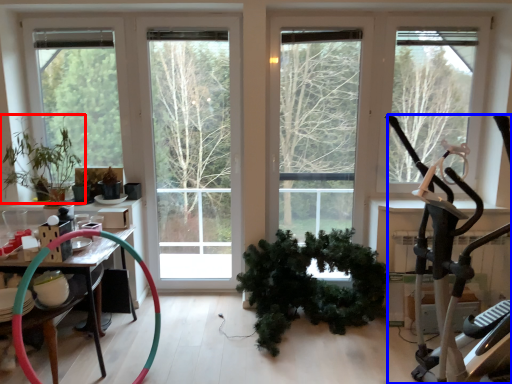
Question: Which object is closer to the camera taking this photo, houseplant (highlighted by a red box) or stationary bicycle (highlighted by a blue box)?

Choices:
 (A) houseplant
 (B) stationary bicycle

Answer: (B)